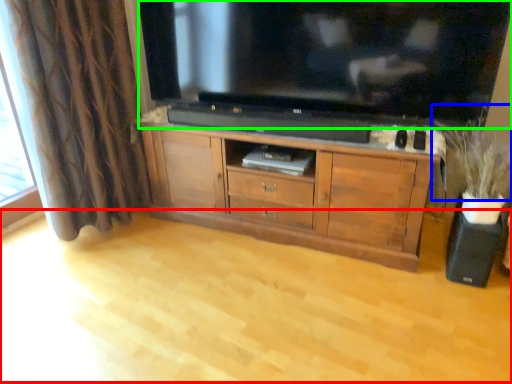
Question: Which is farther away from plain (highlighted by a red box)? plant (highlighted by a blue box) or television (highlighted by a green box)?

Choices:
 (A) plant
 (B) television

Answer: (B)